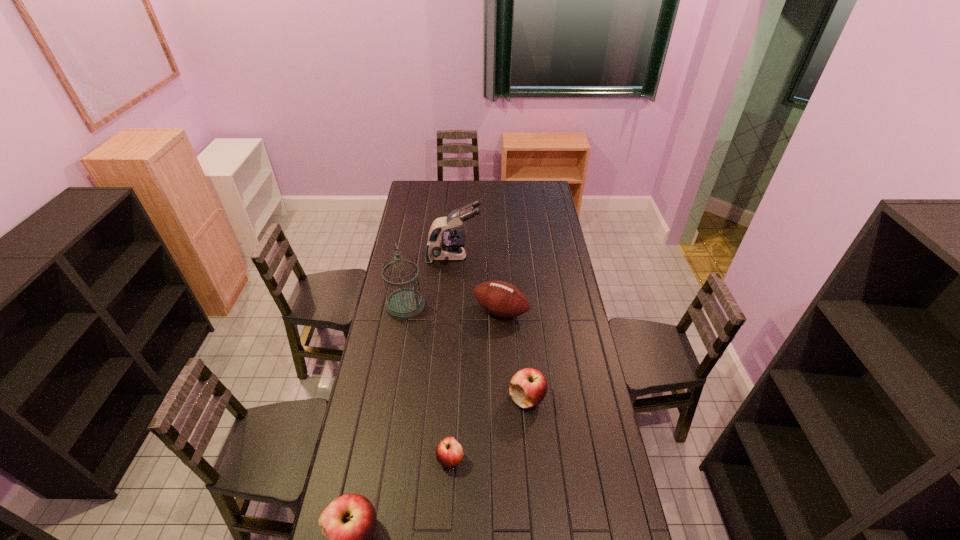
The apples are evenly distributed in the image. To maintain this, where would you place another apple on the right? Please point to a free space. Please provide its 2D coordinates. Your answer should be formatted as a tuple, i.e. [(x, y)], where the tuple contains the x and y coordinates of a point satisfying the conditions above.

[(589, 349)]